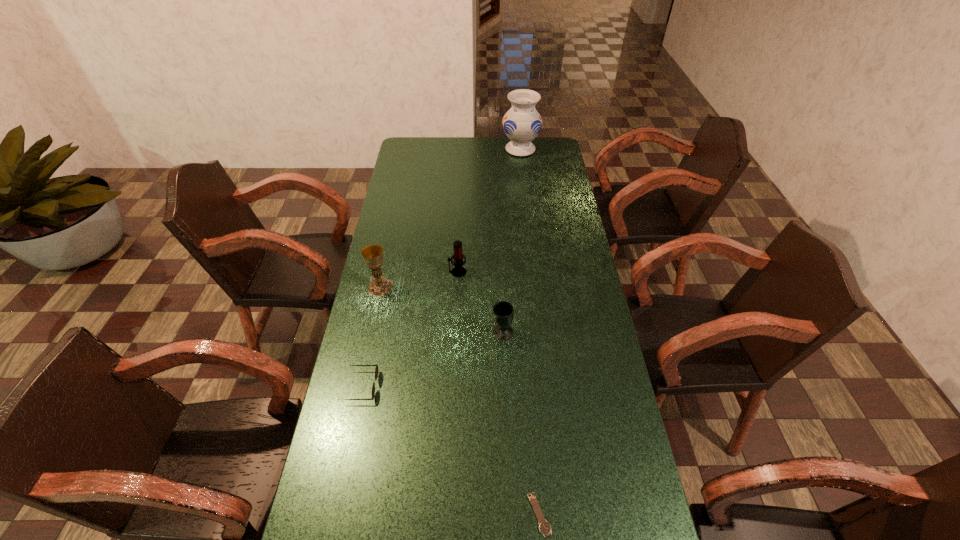
What are the coordinates of `vacant space that satisfies the following two spatial constraints: 1. on the front-facing side of the fifth tallest object; 2. on the left side of the nearest object` in the screenshot? It's located at (336, 515).

The width and height of the screenshot is (960, 540). Find the location of `vacant space that satisfies the following two spatial constraints: 1. on the front side of the vase; 2. on the front-facing side of the fifth tallest object`. vacant space that satisfies the following two spatial constraints: 1. on the front side of the vase; 2. on the front-facing side of the fifth tallest object is located at coordinates (549, 386).

Locate an element on the screen. Image resolution: width=960 pixels, height=540 pixels. blank area in the image that satisfies the following two spatial constraints: 1. on the front-facing side of the nearest object; 2. on the left side of the sunglasses is located at coordinates (336, 515).

The height and width of the screenshot is (540, 960). I want to click on free space that satisfies the following two spatial constraints: 1. on the back side of the left chalice; 2. on the left side of the farthest object, so click(410, 150).